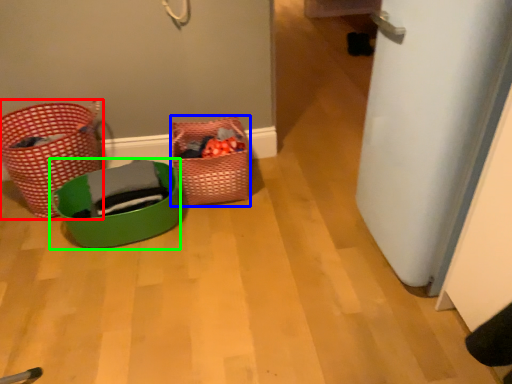
Question: Which object is positioned farthest from basket (highlighted by a red box)? Select from basket (highlighted by a blue box) and basket (highlighted by a green box).

Choices:
 (A) basket
 (B) basket

Answer: (A)